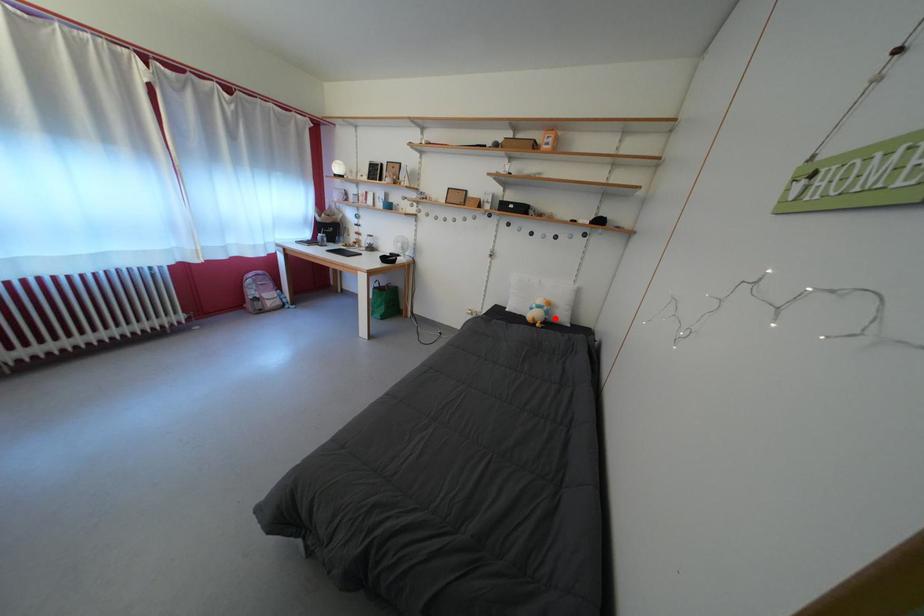
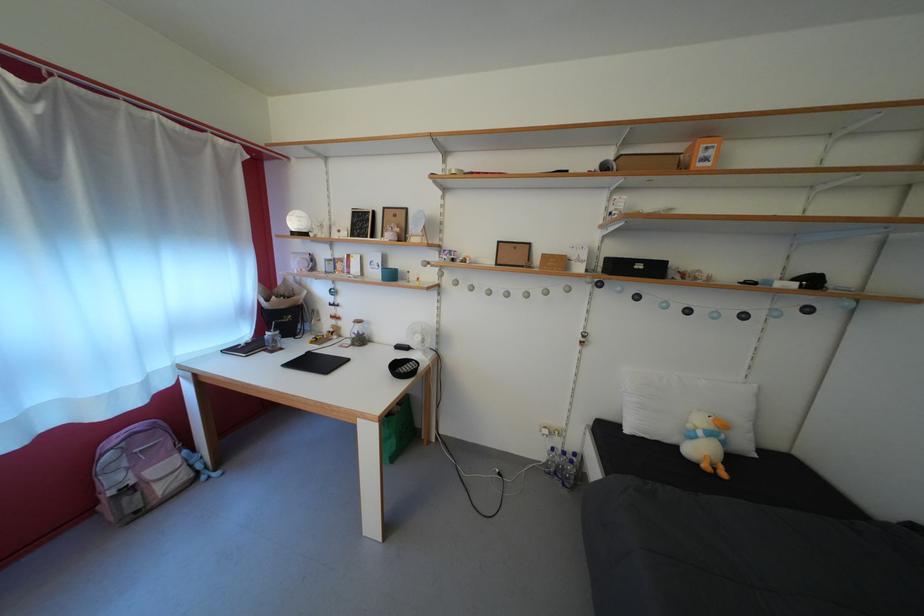
Question: I am providing you with two images of the same scene from different viewpoints. A red point is shown in image1. For the corresponding object point in image2, is it positioned nearer or farther from the camera?

Choices:
 (A) Nearer
 (B) Farther

Answer: (B)